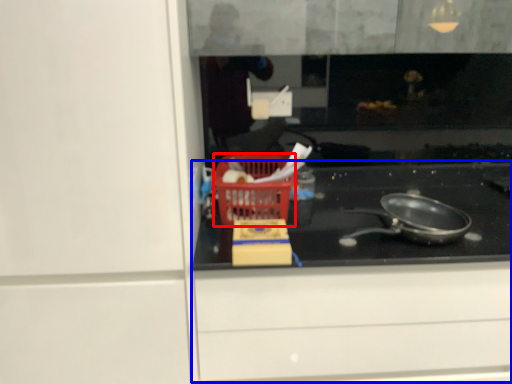
Question: Which point is closer to the camera, basket (highlighted by a red box) or cabinetry (highlighted by a blue box)?

Choices:
 (A) basket
 (B) cabinetry

Answer: (B)